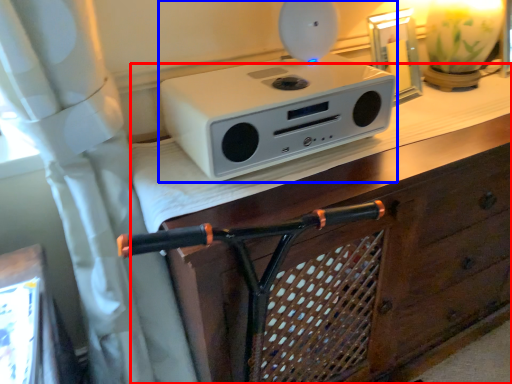
Question: Which point is closer to the camera, vanity (highlighted by a red box) or home appliance (highlighted by a blue box)?

Choices:
 (A) vanity
 (B) home appliance

Answer: (A)